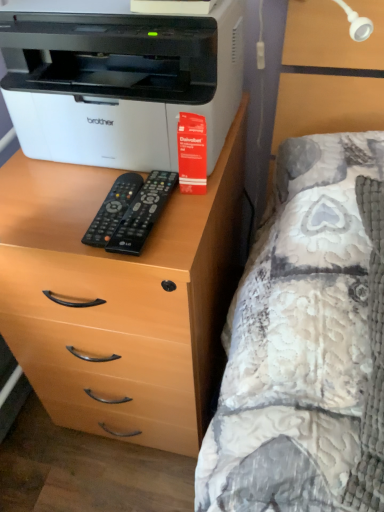
The height and width of the screenshot is (512, 384). I want to click on free space to the back side of black plastic remote at center, arranged as the first remote when viewed from the left, so click(x=95, y=178).